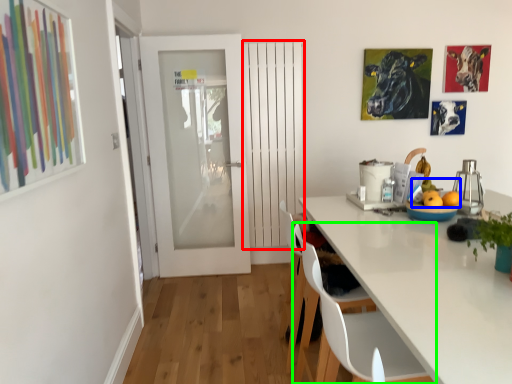
Question: Considering the real-world distances, which object is closest to door (highlighted by a red box)? fruit (highlighted by a blue box) or chair (highlighted by a green box).

Choices:
 (A) fruit
 (B) chair

Answer: (A)